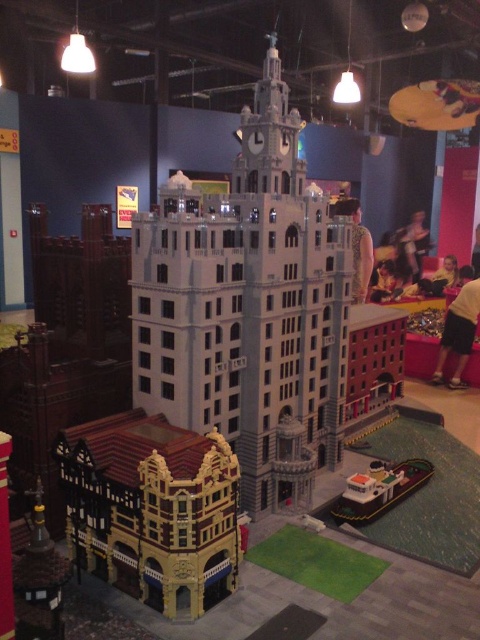
You are a drone operator trying to capture aerial footage of the Lego model. The main tower with the clock face is your primary focus. However, you notice the brown textured building at lower left might block your shot. Based on its coordinates, can you estimate whether this building will obstruct the view of the main tower?

The brown textured building at lower left is positioned at coordinates point (x=153, y=509), which places it in the lower left area of the image. Since the main tower with the clock face is centrally located, the building at lower left is unlikely to obstruct the view of the main tower from an aerial perspective.

You are standing in front of a Lego model of a grand building. You notice a point marked at coordinates [248,307]. Which Lego structure is located exactly at that point?

The light gray lego tower at center is located exactly at point [248,307].

You are a visitor standing at the lower right corner of the Lego model. You want to take a photo of the light gray lego tower at center without any obstructions. Is the white plastic boat at lower right blocking your view of the tower?

The light gray lego tower at center is above the white plastic boat at lower right, so the boat is not blocking the view of the tower since it is positioned below it.